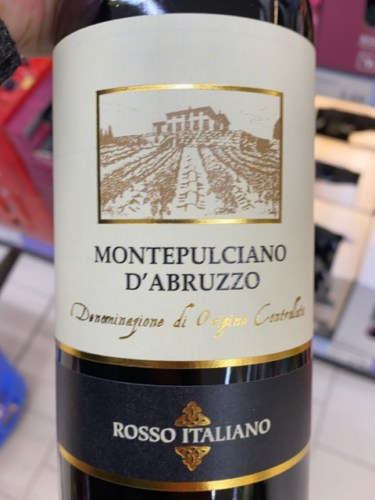
What are the coordinates of `bottle` in the screenshot? It's located at (193, 377).